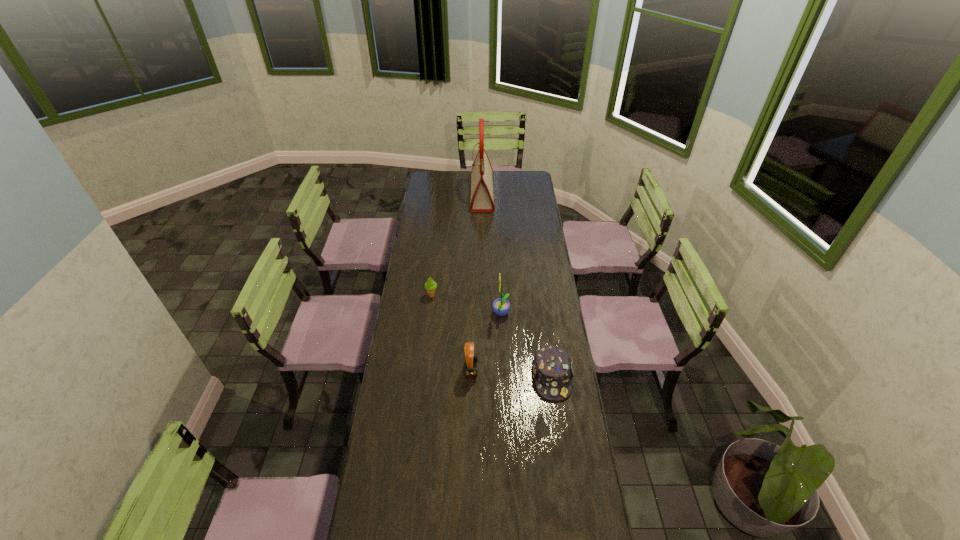
Find the location of a particular element. vacant area located 0.200m on the front-facing side of the sunflower is located at coordinates (448, 314).

Image resolution: width=960 pixels, height=540 pixels. What are the coordinates of `blank space located on the front-facing side of the sunflower` in the screenshot? It's located at (479, 314).

Identify the location of free space located 0.210m on the front-facing side of the sunflower. This screenshot has width=960, height=540. (446, 314).

What are the coordinates of `vacant region located 0.220m on the ear cups of the headset` in the screenshot? It's located at (533, 370).

Where is `vacant space located 0.090m on the left of the icecream`? This screenshot has width=960, height=540. vacant space located 0.090m on the left of the icecream is located at coordinates (407, 295).

Identify the location of free space located on the front-facing side of the rightmost object. This screenshot has height=540, width=960. (560, 429).

This screenshot has height=540, width=960. I want to click on object positioned at the far edge, so click(481, 201).

This screenshot has width=960, height=540. Find the location of `object positioned at the left edge`. object positioned at the left edge is located at coordinates (430, 285).

Find the location of a particular element. Image resolution: width=960 pixels, height=540 pixels. object present at the right edge is located at coordinates (552, 368).

Find the location of a particular element. vacant space at the far edge is located at coordinates (501, 172).